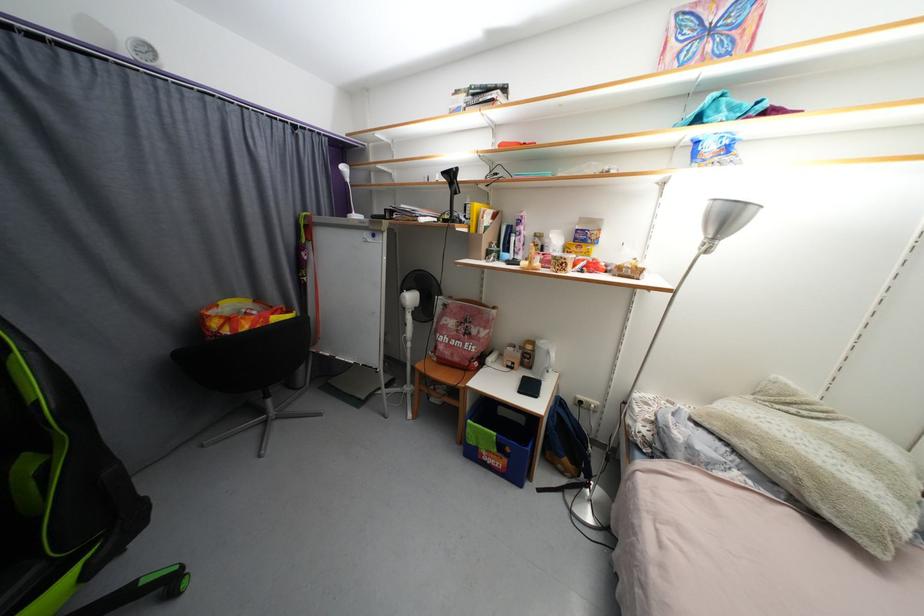
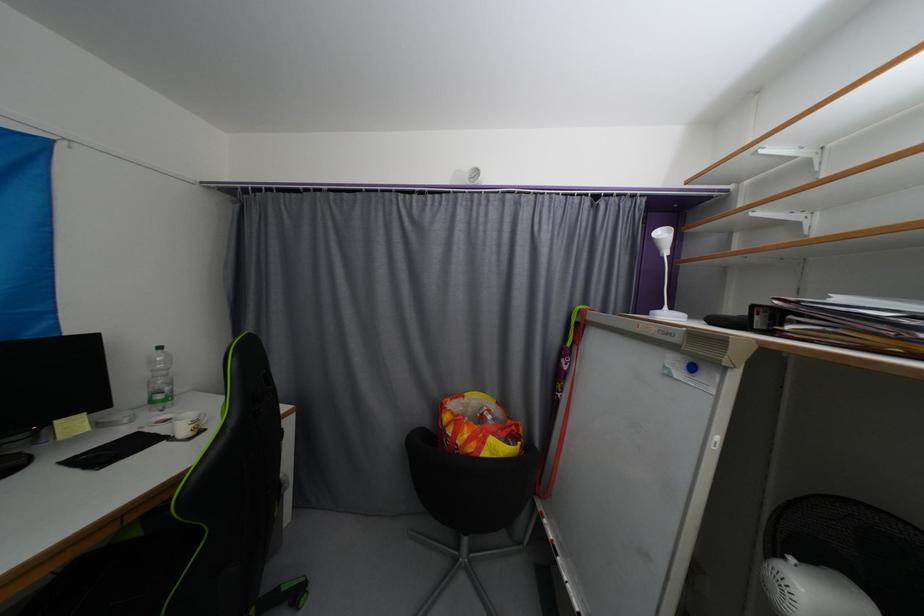
Where in the second image is the point corresponding to [220,326] from the first image?

(452, 419)